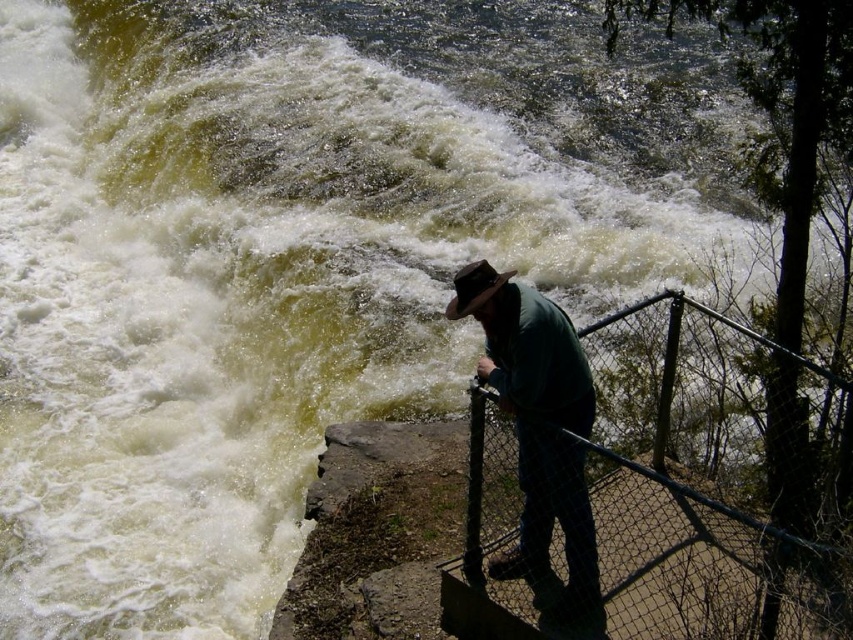
Question: Which object appears closest to the camera in this image?

Choices:
 (A) black wire mesh fence at lower right
 (B) green matte shirt at center

Answer: (B)

Question: Which point appears closest to the camera in this image?

Choices:
 (A) (532, 509)
 (B) (473, 403)

Answer: (B)

Question: Which object appears closest to the camera in this image?

Choices:
 (A) black wire mesh fence at lower right
 (B) green matte shirt at center

Answer: (B)

Question: Is black wire mesh fence at lower right above green matte shirt at center?

Choices:
 (A) no
 (B) yes

Answer: (A)

Question: Can you confirm if black wire mesh fence at lower right is wider than green matte shirt at center?

Choices:
 (A) yes
 (B) no

Answer: (A)

Question: Can you confirm if black wire mesh fence at lower right is smaller than green matte shirt at center?

Choices:
 (A) yes
 (B) no

Answer: (B)